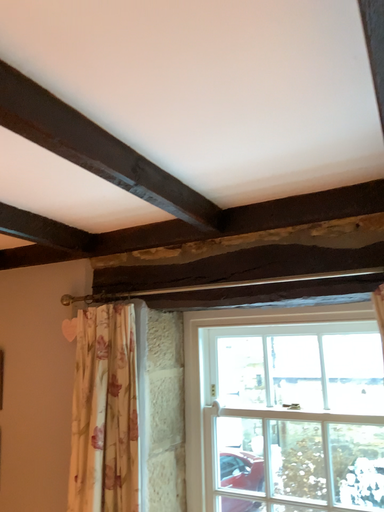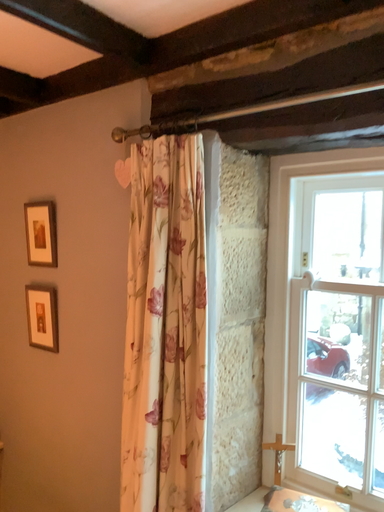
Question: Which way did the camera rotate in the video?

Choices:
 (A) rotated left
 (B) rotated right

Answer: (A)